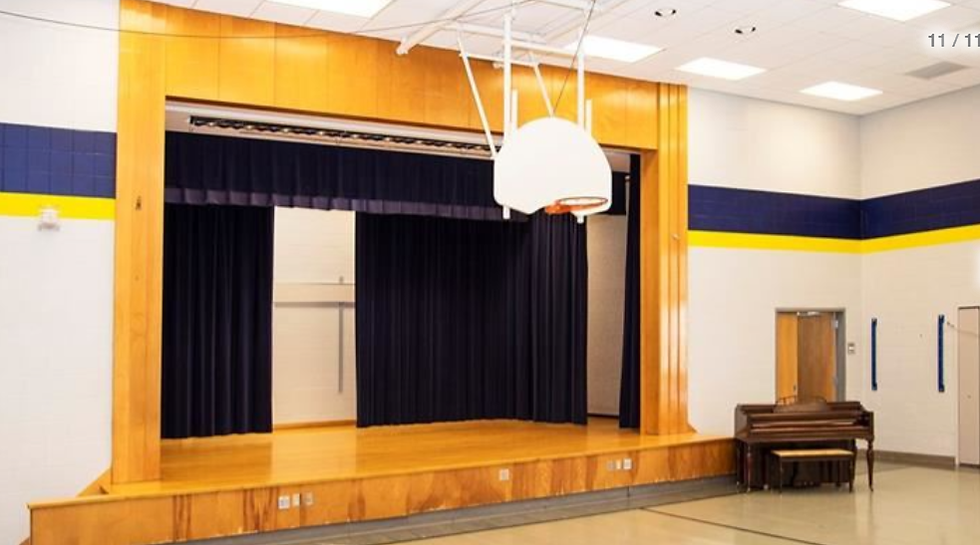
Identify the location of piano. The height and width of the screenshot is (545, 980). (822, 429).